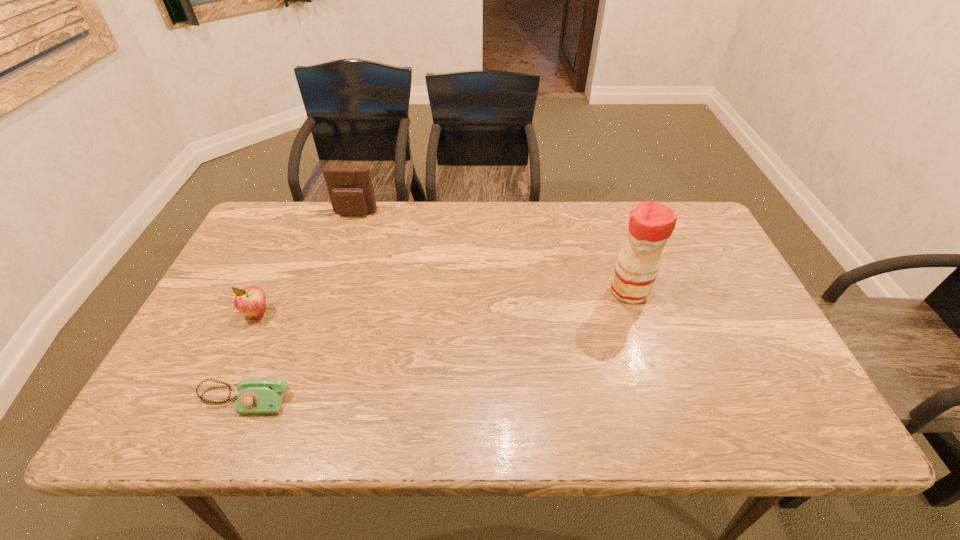
Locate an element on the screen. the rightmost object is located at coordinates (651, 223).

Find the location of a particular element. The height and width of the screenshot is (540, 960). the tallest object is located at coordinates (651, 223).

The image size is (960, 540). I want to click on pouch, so click(x=351, y=192).

Find the location of a particular element. The width and height of the screenshot is (960, 540). the farthest object is located at coordinates (351, 192).

The height and width of the screenshot is (540, 960). In order to click on the second shortest object in this screenshot , I will do `click(251, 301)`.

This screenshot has width=960, height=540. What are the coordinates of `the nearest object` in the screenshot? It's located at (256, 396).

Identify the location of telephone. (256, 396).

Find the location of a particular element. The image size is (960, 540). free space located on the back of the condiment is located at coordinates (620, 265).

This screenshot has height=540, width=960. In order to click on vacant region located with an open flap on the pouch in this screenshot , I will do 329,294.

Identify the location of free space located on the front of the apple. The image size is (960, 540). (211, 411).